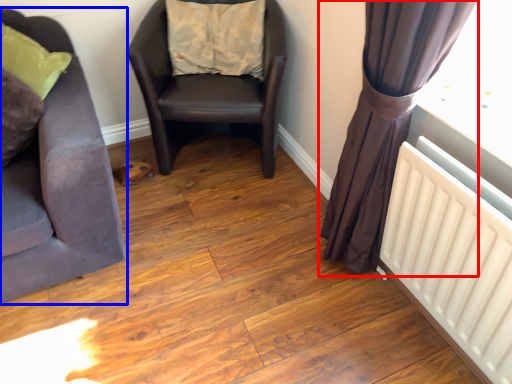
Question: Which object is closer to the camera taking this photo, curtain (highlighted by a red box) or chair (highlighted by a blue box)?

Choices:
 (A) curtain
 (B) chair

Answer: (A)